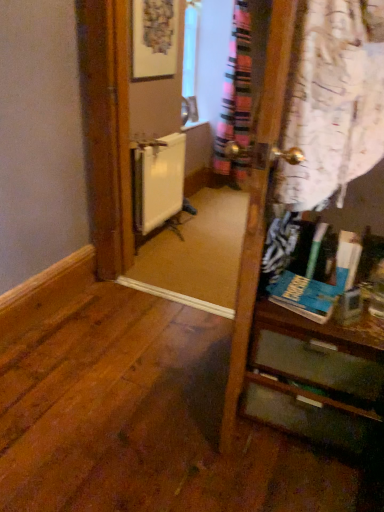
Question: Is matte wooden vanity at right bigger than white matte radiator at center?

Choices:
 (A) yes
 (B) no

Answer: (A)

Question: Is matte wooden vanity at right at the left side of white matte radiator at center?

Choices:
 (A) yes
 (B) no

Answer: (B)

Question: Can you confirm if matte wooden vanity at right is shorter than white matte radiator at center?

Choices:
 (A) yes
 (B) no

Answer: (A)

Question: Is matte wooden vanity at right not close to white matte radiator at center?

Choices:
 (A) yes
 (B) no

Answer: (A)

Question: Considering the relative sizes of matte wooden vanity at right and white matte radiator at center in the image provided, is matte wooden vanity at right taller than white matte radiator at center?

Choices:
 (A) yes
 (B) no

Answer: (B)

Question: Could you tell me if matte wooden vanity at right is facing white matte radiator at center?

Choices:
 (A) yes
 (B) no

Answer: (B)

Question: Does white matte radiator at center have a greater height compared to matte wooden vanity at right?

Choices:
 (A) no
 (B) yes

Answer: (B)

Question: Is white matte radiator at center to the left of matte wooden vanity at right from the viewer's perspective?

Choices:
 (A) yes
 (B) no

Answer: (A)

Question: From a real-world perspective, is white matte radiator at center physically above matte wooden vanity at right?

Choices:
 (A) yes
 (B) no

Answer: (A)

Question: From a real-world perspective, is white matte radiator at center physically below matte wooden vanity at right?

Choices:
 (A) no
 (B) yes

Answer: (A)

Question: Is white matte radiator at center smaller than matte wooden vanity at right?

Choices:
 (A) yes
 (B) no

Answer: (A)

Question: Is the position of white matte radiator at center more distant than that of matte wooden vanity at right?

Choices:
 (A) yes
 (B) no

Answer: (A)

Question: Which is correct: matte wooden vanity at right is inside white matte radiator at center, or outside of it?

Choices:
 (A) outside
 (B) inside

Answer: (A)